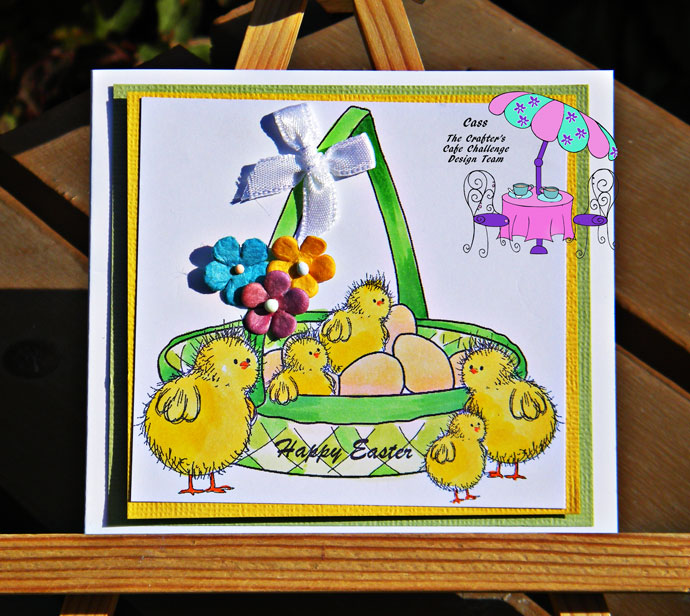
Find the location of a particular element. ribbon bow is located at coordinates (312, 156).